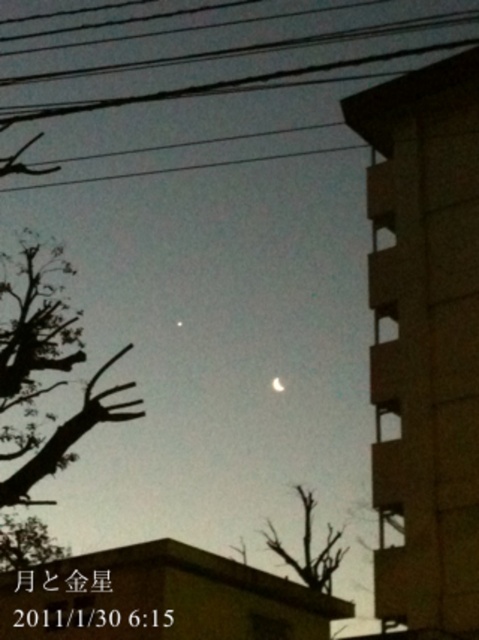
Question: Is black wire at upper center wider than bright silver moon at center?

Choices:
 (A) no
 (B) yes

Answer: (B)

Question: Which point is farther to the camera?

Choices:
 (A) (327, 61)
 (B) (278, 381)

Answer: (A)

Question: Can you confirm if black wire at upper center is positioned above bright silver moon at center?

Choices:
 (A) yes
 (B) no

Answer: (A)

Question: Which of the following is the closest to the observer?

Choices:
 (A) black wire at upper center
 (B) bright silver moon at center

Answer: (A)

Question: Which of the following is the farthest from the observer?

Choices:
 (A) black wire at upper center
 (B) bright silver moon at center

Answer: (B)

Question: Is black wire at upper center below bright silver moon at center?

Choices:
 (A) yes
 (B) no

Answer: (B)